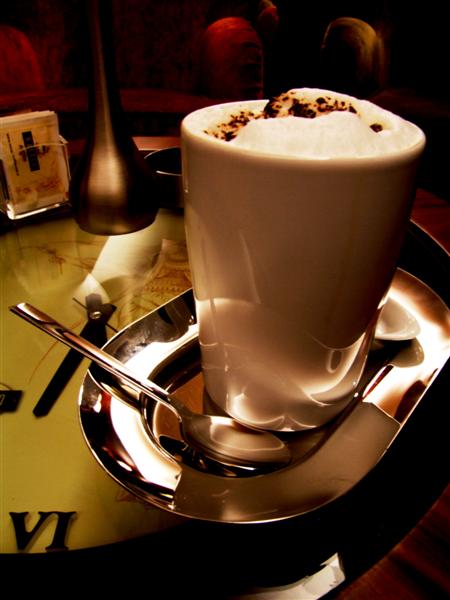
Where is `clock hands`? The width and height of the screenshot is (450, 600). clock hands is located at coordinates (111, 328), (104, 328), (68, 371).